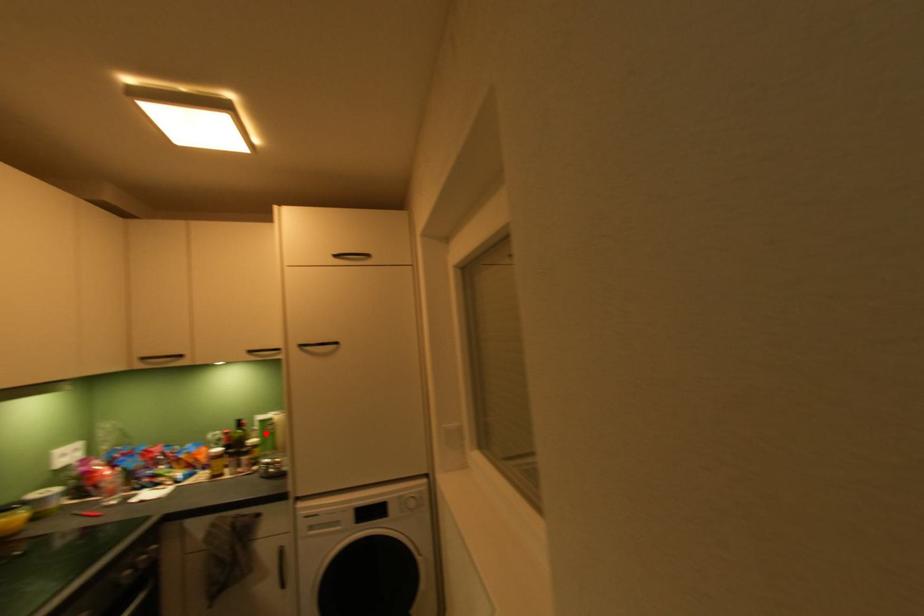
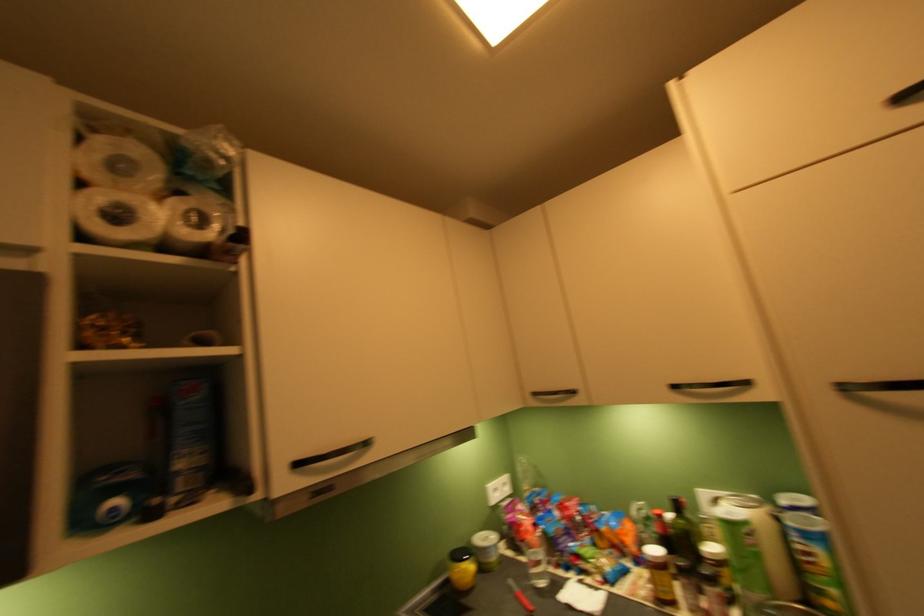
Locate, in the second image, the point that corresponds to the highlighted location in the first image.

(715, 524)